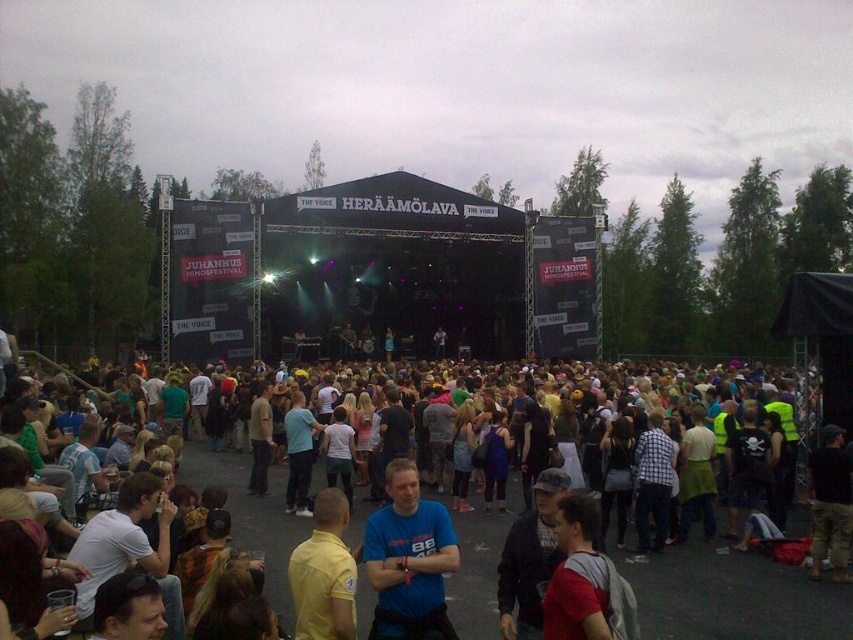
Question: Among these objects, which one is nearest to the camera?

Choices:
 (A) multicolored casual clothing at center
 (B) yellow matte shirt at center
 (C) blue matte shirt at center
 (D) red fabric backpack at center

Answer: (D)

Question: Is blue matte shirt at center positioned at the back of red fabric backpack at center?

Choices:
 (A) no
 (B) yes

Answer: (B)

Question: Does red fabric backpack at center lie in front of yellow matte shirt at center?

Choices:
 (A) yes
 (B) no

Answer: (A)

Question: Is red fabric backpack at center positioned at the back of yellow matte shirt at center?

Choices:
 (A) no
 (B) yes

Answer: (A)

Question: Which object is closer to the camera taking this photo?

Choices:
 (A) blue matte shirt at center
 (B) multicolored casual clothing at center

Answer: (B)

Question: Which object appears farthest from the camera in this image?

Choices:
 (A) blue matte shirt at center
 (B) yellow matte shirt at center

Answer: (A)